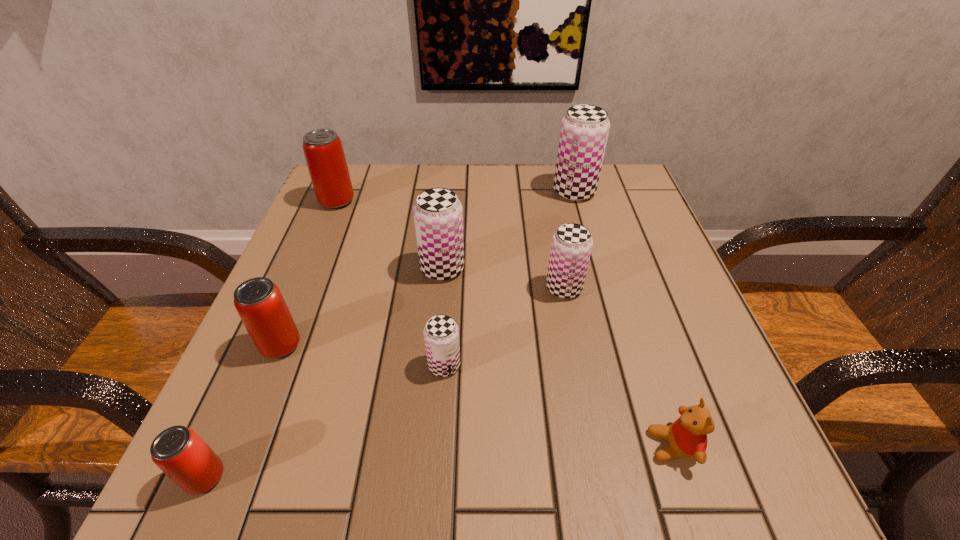
In the image, there is a desktop. At what (x,y) coordinates should I click in order to perform the action: click on vacant space at the left edge. Please return your answer as a coordinate pair (x, y). Looking at the image, I should click on (243, 399).

Where is `vacant space at the right edge of the desktop`? vacant space at the right edge of the desktop is located at coordinates (622, 354).

What are the coordinates of `vacant space at the near left corner of the desktop` in the screenshot? It's located at (282, 459).

Where is `empty space that is in between the third smallest purple beer can and the biggest pink beer can`? The height and width of the screenshot is (540, 960). empty space that is in between the third smallest purple beer can and the biggest pink beer can is located at coordinates (390, 235).

Find the location of a particular element. This screenshot has height=540, width=960. free area in between the smallest purple beer can and the nearest pink beer can is located at coordinates (324, 421).

Locate an element on the screen. free space between the red teddy bear and the tallest beer can is located at coordinates (624, 319).

The width and height of the screenshot is (960, 540). I want to click on empty location between the smallest purple beer can and the third biggest purple beer can, so click(504, 327).

In order to click on empty location between the red teddy bear and the second smallest pink beer can in this screenshot , I will do `click(477, 395)`.

Identify the location of vacant space that's between the smallest pink beer can and the teddy bear. The image size is (960, 540). (439, 462).

Identify the location of vacant space that's between the biggest pink beer can and the red teddy bear. (505, 323).